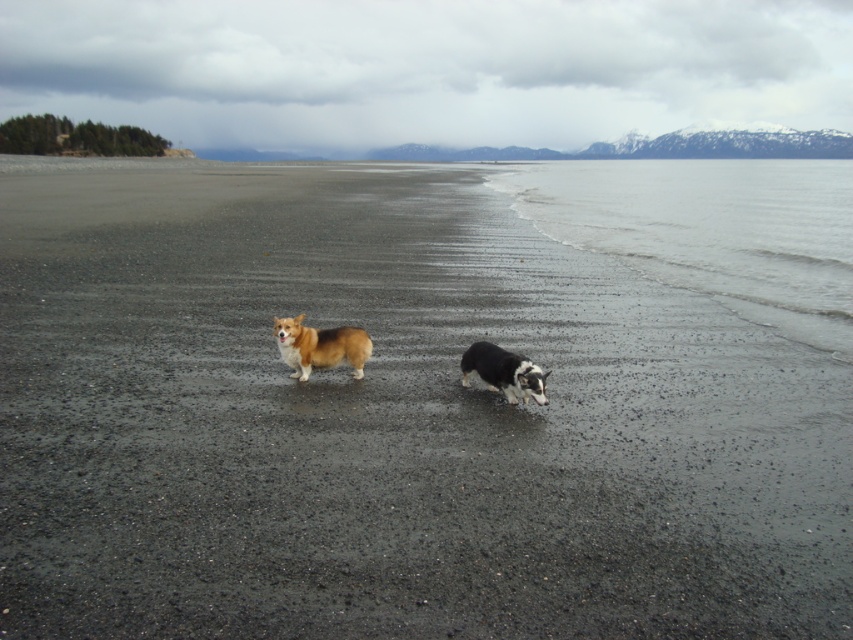
Question: Which object is closer to the camera taking this photo?

Choices:
 (A) brown plush corgi at center
 (B) black and white fur dog at center
 (C) clear water at lower right

Answer: (B)

Question: Estimate the real-world distances between objects in this image. Which object is closer to the brown plush corgi at center?

Choices:
 (A) black and white fur dog at center
 (B) clear water at lower right

Answer: (A)

Question: Is brown plush corgi at center positioned behind black and white fur dog at center?

Choices:
 (A) no
 (B) yes

Answer: (B)

Question: Which point is closer to the camera?

Choices:
 (A) pyautogui.click(x=509, y=381)
 (B) pyautogui.click(x=498, y=189)
 (C) pyautogui.click(x=357, y=332)

Answer: (A)

Question: Does clear water at lower right have a greater width compared to brown plush corgi at center?

Choices:
 (A) no
 (B) yes

Answer: (B)

Question: Can you confirm if clear water at lower right is positioned above black and white fur dog at center?

Choices:
 (A) yes
 (B) no

Answer: (A)